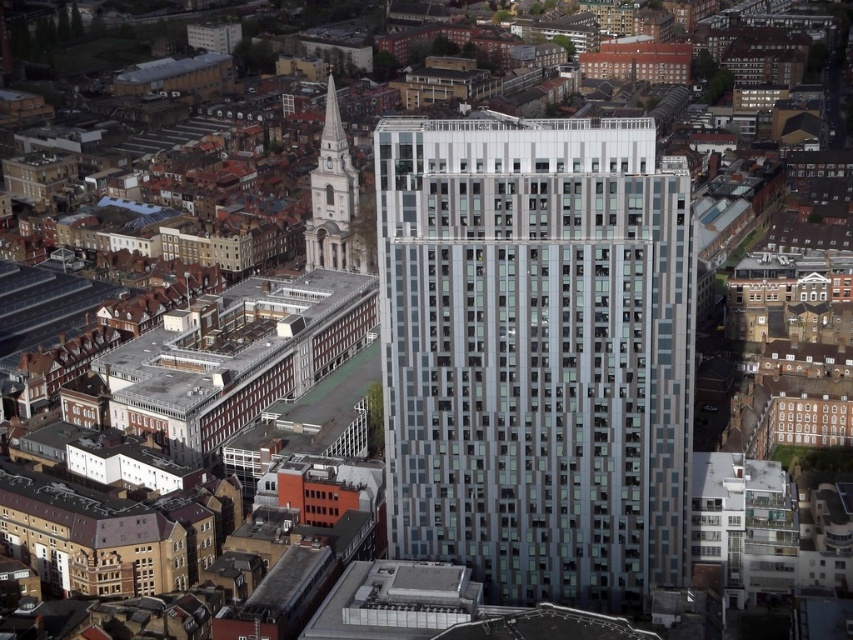
You are a drone operator trying to capture a photo of the silver glass building at center and the white stone tower at upper left. From your current position, which building is positioned lower in the frame?

The silver glass building at center is located below the white stone tower at upper left, so it is positioned lower in the frame.

You are a drone operator who needs to deliver a package to a specific point in the urban area shown. The point is labeled as point [438,541]. Your drone has a maximum flight range of 700 feet. Can your drone reach this point from your current position?

The distance of point [438,541] from the camera is 671.59 feet. Since the drone has a maximum flight range of 700 feet, it can reach the point as the distance is within the range.

You are a drone operator flying over the urban area shown in the image. You need to determine the shortest path between the two points, point (550, 310) and point (314, 211). Considering the buildings in the scene, which point is closer to the tall modern building at center right?

Point (550, 310) is closer to the viewer than point (314, 211), so it is also closer to the tall modern building at center right.